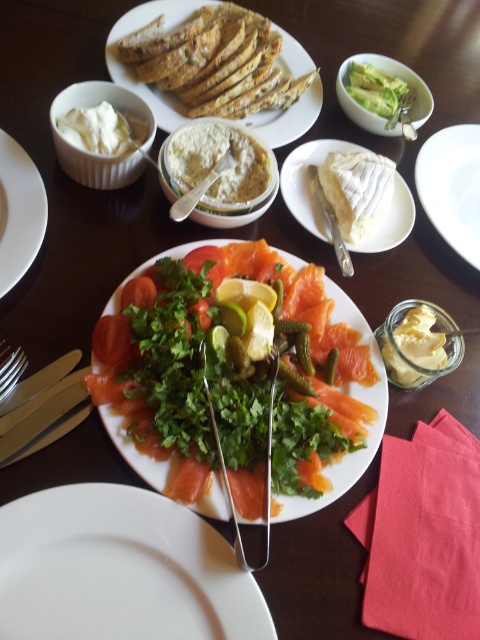
Question: Which object is the farthest from the white creamy cheese at center?

Choices:
 (A) white matte plate at upper left
 (B) silvermetallicknife at right
 (C) white creamy cheese at upper right

Answer: (A)

Question: Based on their relative distances, which object is nearer to the white matte plate at upper right?

Choices:
 (A) white creamy cheese at center
 (B) white matte plate at upper left
 (C) white creamy cheese at upper right
 (D) green leafy vegetable at upper right

Answer: (A)

Question: Which is farther from the green leafy vegetable at upper right?

Choices:
 (A) yellow creamy spread at lower right
 (B) white matte plate at center

Answer: (B)

Question: Is fresh green salad at center to the left of yellow creamy spread at lower right from the viewer's perspective?

Choices:
 (A) yes
 (B) no

Answer: (A)

Question: Can you confirm if brown crusty bread at upper center is positioned below green leafy vegetable at upper right?

Choices:
 (A) no
 (B) yes

Answer: (A)

Question: Does white matte plate at upper left have a larger size compared to white creamy cheese at upper right?

Choices:
 (A) no
 (B) yes

Answer: (A)